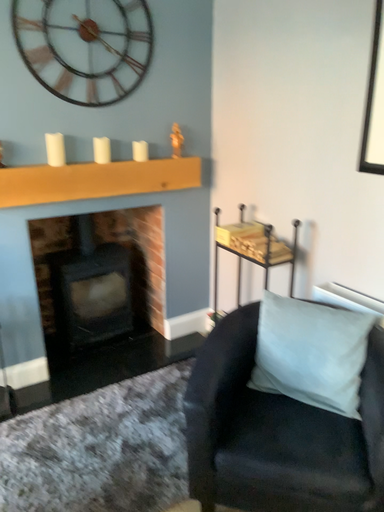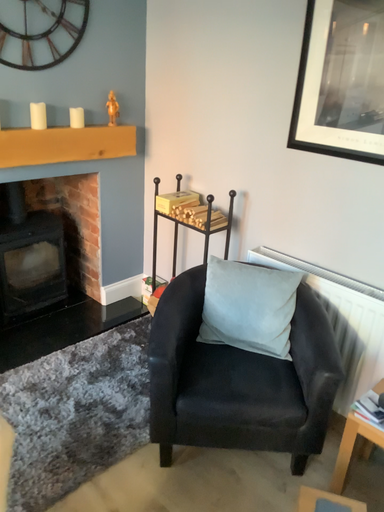
Question: Which way did the camera rotate in the video?

Choices:
 (A) rotated left
 (B) rotated right

Answer: (B)